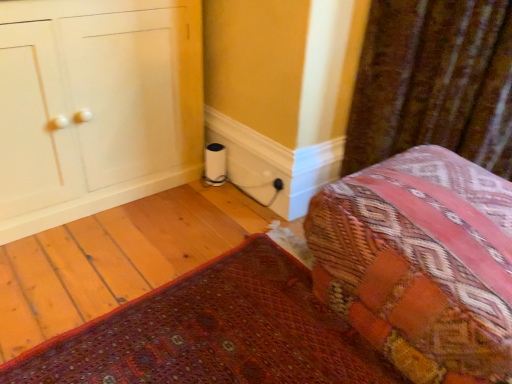
Question: Does velvet brown curtain at upper right touch patterned fabric cushion at lower right, marked as the second furniture in a top-to-bottom arrangement?

Choices:
 (A) yes
 (B) no

Answer: (B)

Question: Is velvet brown curtain at upper right bigger than patterned fabric cushion at lower right, marked as the second furniture in a top-to-bottom arrangement?

Choices:
 (A) no
 (B) yes

Answer: (A)

Question: Is velvet brown curtain at upper right positioned in front of patterned fabric cushion at lower right, marked as the second furniture in a top-to-bottom arrangement?

Choices:
 (A) yes
 (B) no

Answer: (B)

Question: Is velvet brown curtain at upper right located outside patterned fabric cushion at lower right, marked as the second furniture in a top-to-bottom arrangement?

Choices:
 (A) no
 (B) yes

Answer: (B)

Question: Would you consider velvet brown curtain at upper right to be distant from patterned fabric cushion at lower right, which ranks as the 1th furniture in bottom-to-top order?

Choices:
 (A) no
 (B) yes

Answer: (A)

Question: In the image, is black plastic electric outlet at lower right positioned in front of or behind patterned fabric cushion at lower right, marked as the second furniture in a top-to-bottom arrangement?

Choices:
 (A) front
 (B) behind

Answer: (B)

Question: Is black plastic electric outlet at lower right taller or shorter than patterned fabric cushion at lower right, marked as the second furniture in a top-to-bottom arrangement?

Choices:
 (A) tall
 (B) short

Answer: (B)

Question: Considering the positions of point (273, 182) and point (338, 264), is point (273, 182) closer or farther from the camera than point (338, 264)?

Choices:
 (A) farther
 (B) closer

Answer: (A)

Question: From the image's perspective, is black plastic electric outlet at lower right above or below patterned fabric cushion at lower right, marked as the second furniture in a top-to-bottom arrangement?

Choices:
 (A) below
 (B) above

Answer: (B)

Question: Do you think textured woven bed at lower right is within patterned fabric cushion at lower right, marked as the second furniture in a top-to-bottom arrangement, or outside of it?

Choices:
 (A) inside
 (B) outside

Answer: (B)

Question: From a real-world perspective, is textured woven bed at lower right physically located above or below patterned fabric cushion at lower right, which ranks as the 1th furniture in bottom-to-top order?

Choices:
 (A) above
 (B) below

Answer: (A)

Question: Is textured woven bed at lower right taller or shorter than patterned fabric cushion at lower right, marked as the second furniture in a top-to-bottom arrangement?

Choices:
 (A) short
 (B) tall

Answer: (B)

Question: Considering the positions of textured woven bed at lower right and patterned fabric cushion at lower right, marked as the second furniture in a top-to-bottom arrangement, in the image, is textured woven bed at lower right wider or thinner than patterned fabric cushion at lower right, marked as the second furniture in a top-to-bottom arrangement,?

Choices:
 (A) thin
 (B) wide

Answer: (A)

Question: From their relative heights in the image, would you say white glossy cabinet at left, the second furniture ordered from the bottom, is taller or shorter than textured woven bed at lower right?

Choices:
 (A) short
 (B) tall

Answer: (B)

Question: In the image, is white glossy cabinet at left, which is counted as the 1th furniture, starting from the top, on the left side or the right side of textured woven bed at lower right?

Choices:
 (A) left
 (B) right

Answer: (A)